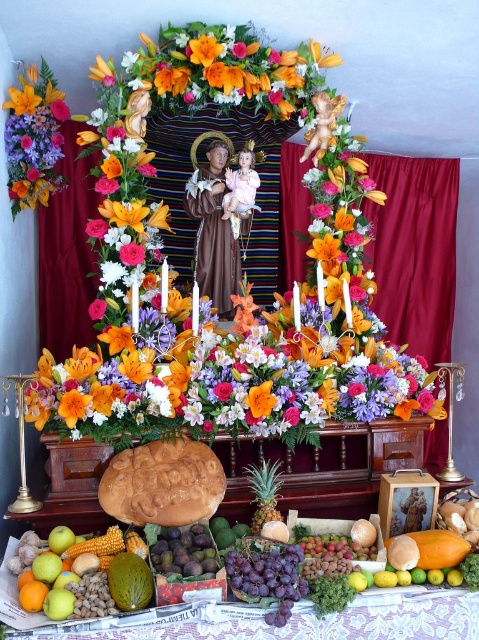
Is vibrant silk flowers at center bigger than lacquered wood table at lower center?

Indeed, vibrant silk flowers at center has a larger size compared to lacquered wood table at lower center.

Looking at this image, is the position of vibrant silk flowers at center less distant than that of lacquered wood table at lower center?

No, it is behind lacquered wood table at lower center.

Is point (340, 200) farther from viewer compared to point (296, 636)?

Yes, it is.

Locate an element on the screen. Image resolution: width=479 pixels, height=640 pixels. vibrant silk flowers at center is located at coordinates (163, 284).

Does lacquered wood table at lower center have a greater width compared to orange matte flower at center?

Yes.

Which of these two, lacquered wood table at lower center or orange matte flower at center, stands taller?

lacquered wood table at lower center

Locate an element on the screen. lacquered wood table at lower center is located at coordinates (296, 620).

In order to click on lacquered wood table at lower center in this screenshot , I will do `click(296, 620)`.

Does brown carved wood altar at center have a larger size compared to lacquered wood table at lower center?

Indeed, brown carved wood altar at center has a larger size compared to lacquered wood table at lower center.

In the scene shown: Who is more distant from viewer, (x=415, y=440) or (x=189, y=636)?

The point (x=415, y=440) is more distant.

In order to click on brown carved wood altar at center in this screenshot , I will do `click(326, 467)`.